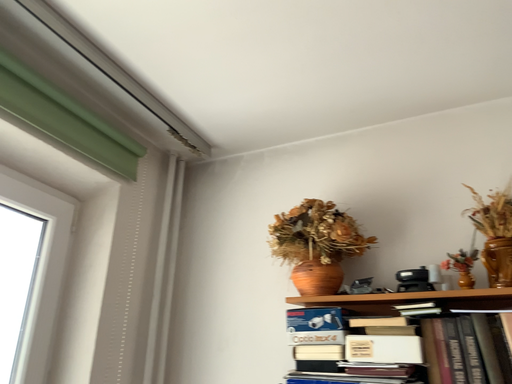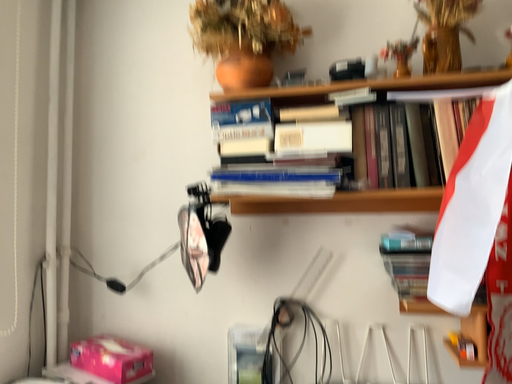
Question: Which way did the camera rotate in the video?

Choices:
 (A) rotated upward
 (B) rotated downward

Answer: (B)